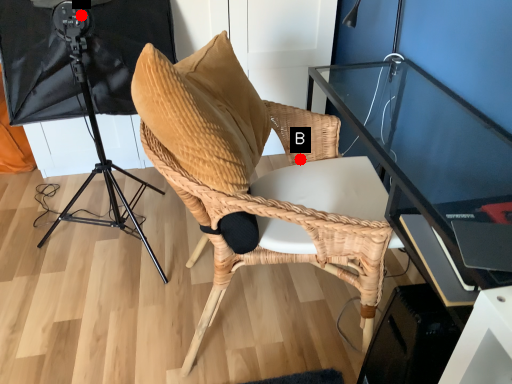
Question: Two points are circled on the image, labeled by A and B beside each circle. Which point is closer to the camera taking this photo?

Choices:
 (A) A is closer
 (B) B is closer

Answer: (A)